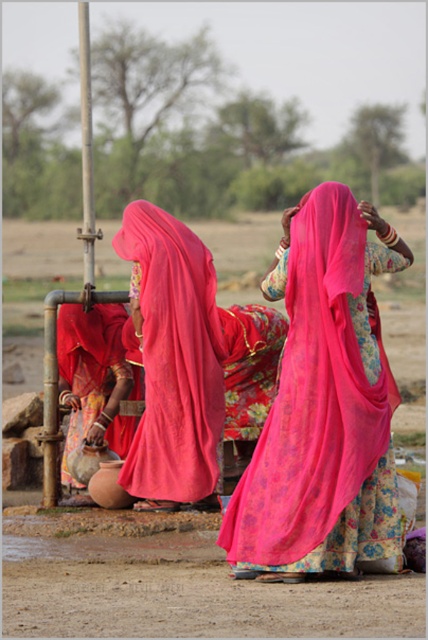
Can you confirm if silky pink sari at center is wider than matte clay pot at lower left?

Yes.

Describe the element at coordinates (184, 358) in the screenshot. The height and width of the screenshot is (640, 428). I see `silky pink sari at center` at that location.

You are a GUI agent. You are given a task and a screenshot of the screen. Output one action in this format:
    pyautogui.click(x=<x>, y=<y>)
    Task: Click on the silky pink sari at center
    The height and width of the screenshot is (640, 428).
    Given the screenshot: What is the action you would take?
    pyautogui.click(x=184, y=358)

Is matte pink fabric at center thinner than silky pink sari at center?

Yes, matte pink fabric at center is thinner than silky pink sari at center.

This screenshot has width=428, height=640. I want to click on matte pink fabric at center, so click(x=323, y=403).

Find the location of a particular element. The image size is (428, 640). matte pink fabric at center is located at coordinates (323, 403).

Which is more to the left, matte pink fabric at center or matte clay pot at lower left?

matte clay pot at lower left

Can you confirm if matte pink fabric at center is wider than matte clay pot at lower left?

Yes.

I want to click on matte pink fabric at center, so click(x=323, y=403).

Find the location of `matte pink fabric at center`. matte pink fabric at center is located at coordinates (323, 403).